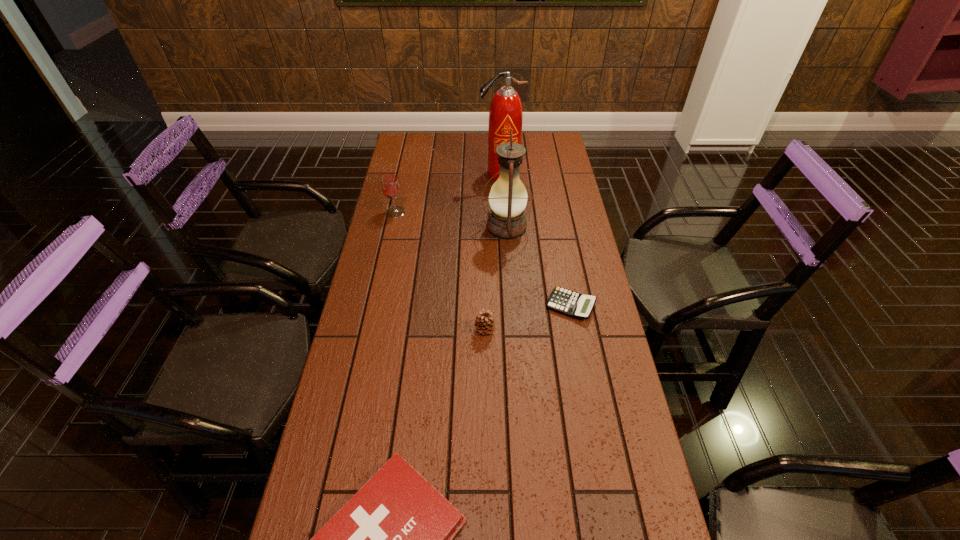
Locate an element on the screen. vacant space situated on the left of the calculator is located at coordinates (481, 306).

You are a GUI agent. You are given a task and a screenshot of the screen. Output one action in this format:
    pyautogui.click(x=<x>, y=<y>)
    Task: Click on the object that is at the left edge
    
    Given the screenshot: What is the action you would take?
    pyautogui.click(x=390, y=184)

You are a GUI agent. You are given a task and a screenshot of the screen. Output one action in this format:
    pyautogui.click(x=<x>, y=<y>)
    Task: Click on the object at the right edge
    The width and height of the screenshot is (960, 540).
    Given the screenshot: What is the action you would take?
    pyautogui.click(x=573, y=304)

Image resolution: width=960 pixels, height=540 pixels. Find the location of `free region at the far edge of the desktop`. free region at the far edge of the desktop is located at coordinates (479, 155).

In the image, there is a desktop. Where is `vacant space at the left edge`? This screenshot has width=960, height=540. vacant space at the left edge is located at coordinates (408, 179).

Find the location of a particular element. This screenshot has width=960, height=540. free space at the right edge of the desktop is located at coordinates (587, 233).

Locate an element on the screen. Image resolution: width=960 pixels, height=540 pixels. vacant area at the far right corner of the desktop is located at coordinates (565, 155).

Where is `blank region between the fourth shortest object and the oil lamp`? The image size is (960, 540). blank region between the fourth shortest object and the oil lamp is located at coordinates (451, 219).

I want to click on free space between the fourth shortest object and the fire extinguisher, so click(448, 193).

Where is `unoccupied area between the pinecone and the shortest object`? unoccupied area between the pinecone and the shortest object is located at coordinates (528, 318).